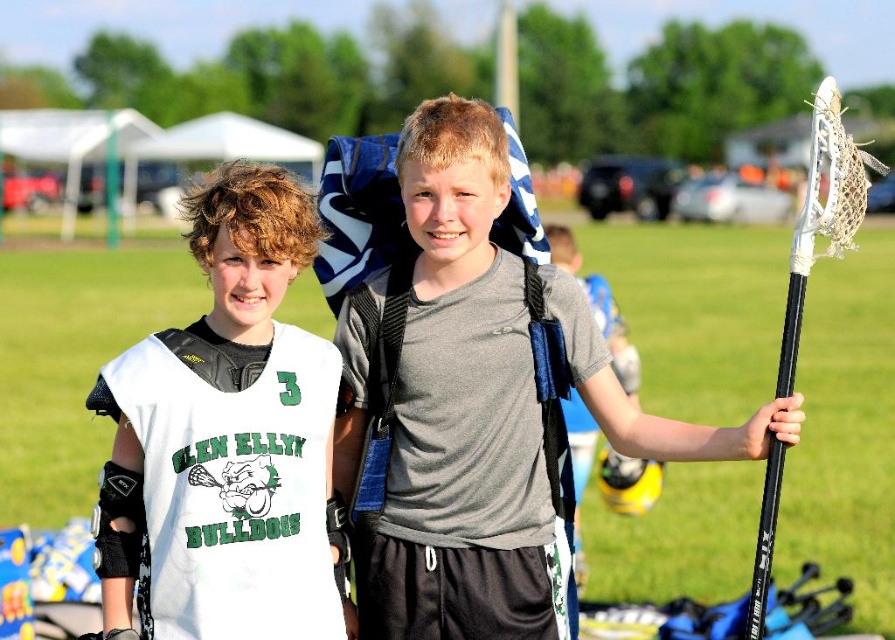
Question: Is gray matte shirt at center bigger than black matte lacrosse stick at right?

Choices:
 (A) yes
 (B) no

Answer: (B)

Question: Is white matte jersey at center below black matte lacrosse stick at right?

Choices:
 (A) yes
 (B) no

Answer: (A)

Question: Which point is farther to the camera?

Choices:
 (A) (240, 196)
 (B) (500, 588)

Answer: (B)

Question: Is gray matte shirt at center to the left of white matte jersey at center from the viewer's perspective?

Choices:
 (A) yes
 (B) no

Answer: (B)

Question: Which of the following is the farthest from the observer?

Choices:
 (A) (314, 600)
 (B) (484, 323)
 (C) (823, 218)

Answer: (B)

Question: Which point is closer to the camera?

Choices:
 (A) gray matte shirt at center
 (B) black matte lacrosse stick at right

Answer: (B)